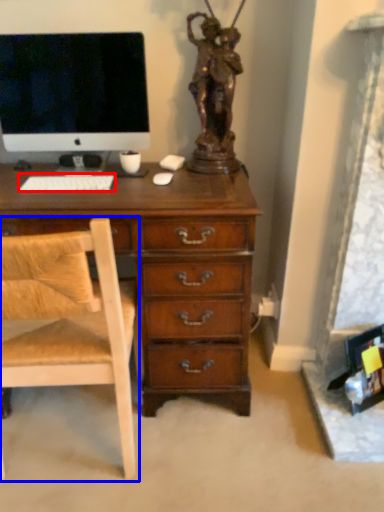
Question: Which object is closer to the camera taking this photo, computer keyboard (highlighted by a red box) or chair (highlighted by a blue box)?

Choices:
 (A) computer keyboard
 (B) chair

Answer: (B)